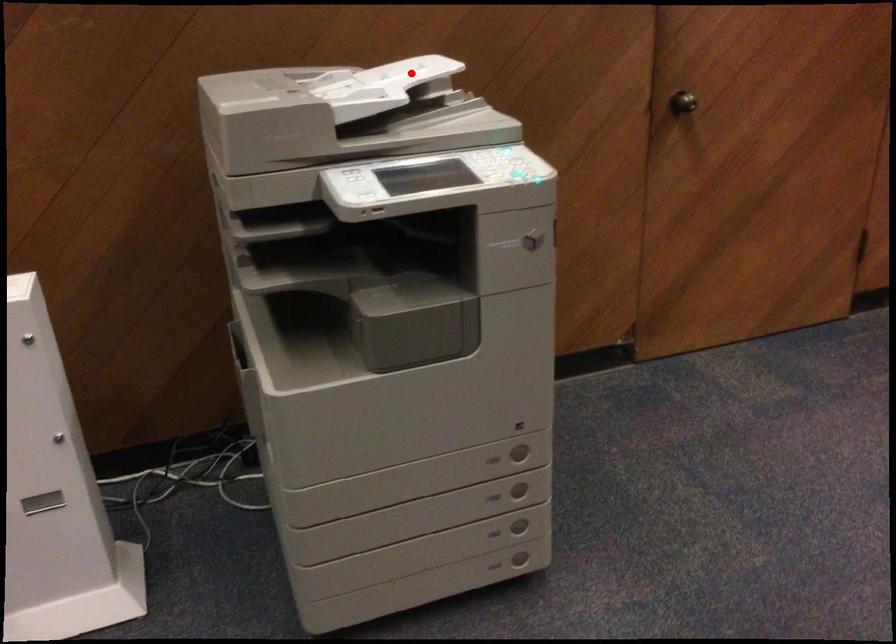
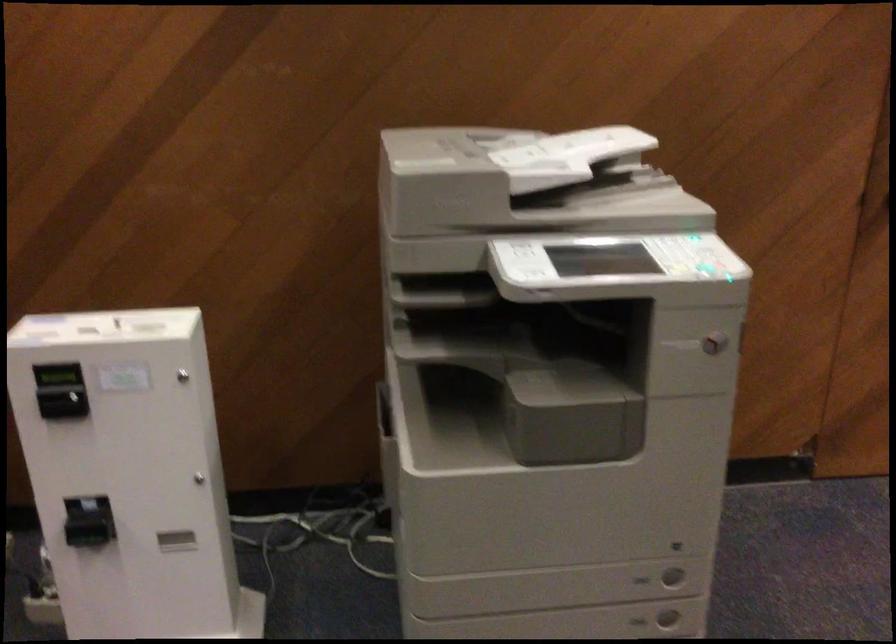
The point at the highlighted location is marked in the first image. Where is the corresponding point in the second image?

(600, 143)